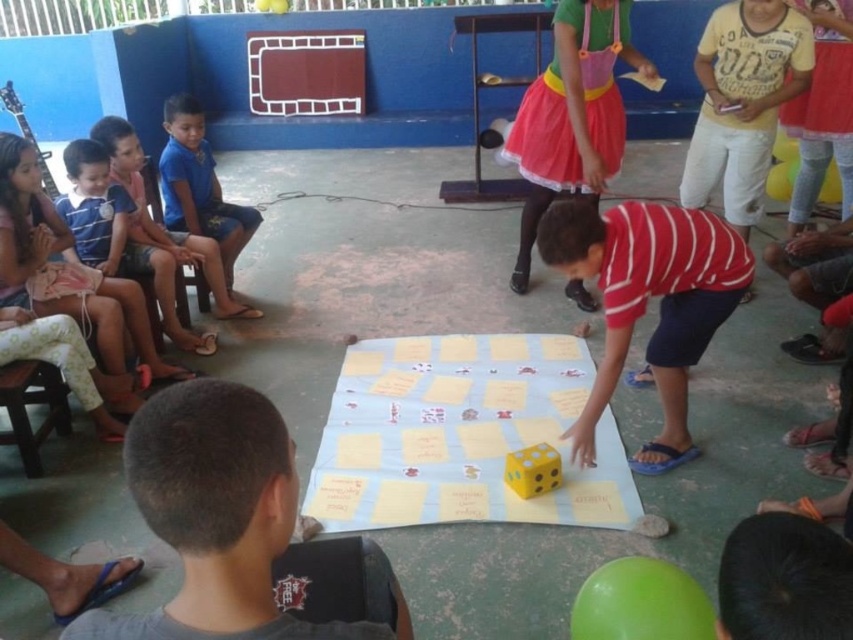
Question: Can you confirm if yellow matte dice at center is positioned below blue fabric shorts at left?

Choices:
 (A) yes
 (B) no

Answer: (A)

Question: Which is farther from the striped cotton shirt at left?

Choices:
 (A) brown hair at center
 (B) yellow matte dice at center

Answer: (A)

Question: Can you confirm if brown hair at center is wider than yellow matte dice at center?

Choices:
 (A) no
 (B) yes

Answer: (A)

Question: Considering the real-world distances, which object is closest to the yellow matte dice at center?

Choices:
 (A) striped cotton shirt at left
 (B) brown hair at center

Answer: (B)

Question: Which object appears farthest from the camera in this image?

Choices:
 (A) yellow matte dice at center
 (B) striped cotton shirt at left

Answer: (B)

Question: Is yellow matte dice at center below blue fabric shorts at left?

Choices:
 (A) no
 (B) yes

Answer: (B)